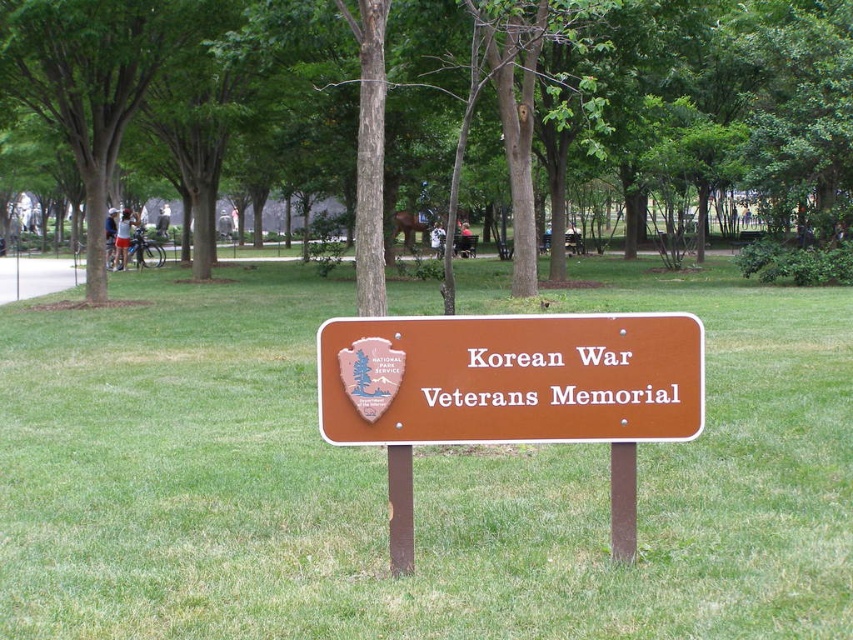
Question: Is green leafy tree at center to the left of brown wooden sign at center from the viewer's perspective?

Choices:
 (A) yes
 (B) no

Answer: (B)

Question: Among these points, which one is nearest to the camera?

Choices:
 (A) (809, 68)
 (B) (409, 394)
 (C) (236, 289)

Answer: (B)

Question: Which object is farther from the camera taking this photo?

Choices:
 (A) green leafy tree at center
 (B) green grassy at center
 (C) brown wooden sign at center

Answer: (A)

Question: Is green grassy at center closer to the viewer compared to green leafy tree at center?

Choices:
 (A) no
 (B) yes

Answer: (B)

Question: Among these objects, which one is nearest to the camera?

Choices:
 (A) green grassy at center
 (B) green leafy tree at center

Answer: (A)

Question: Does green grassy at center appear on the right side of brown wooden sign at center?

Choices:
 (A) no
 (B) yes

Answer: (A)